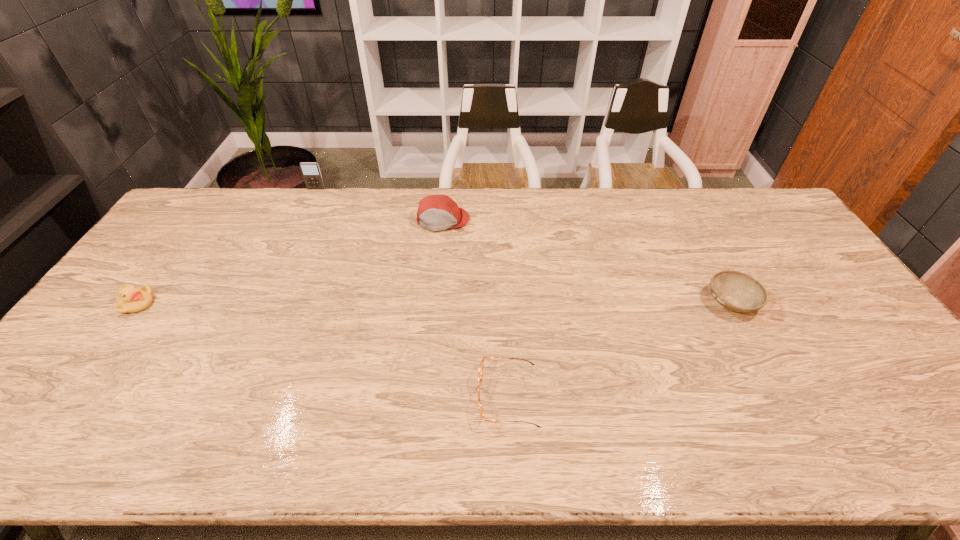
Image resolution: width=960 pixels, height=540 pixels. I want to click on vacant space located 0.140m on the front-facing side of the duckling, so click(202, 304).

You are a GUI agent. You are given a task and a screenshot of the screen. Output one action in this format:
    pyautogui.click(x=<x>, y=<y>)
    Task: Click on the vacant space situated 0.050m on the left of the rightmost object
    This screenshot has width=960, height=540.
    Given the screenshot: What is the action you would take?
    pyautogui.click(x=688, y=302)

Image resolution: width=960 pixels, height=540 pixels. I want to click on vacant space located 0.140m on the front-facing side of the second object from right to left, so click(x=420, y=396).

The width and height of the screenshot is (960, 540). In order to click on vacant point located on the front-facing side of the second object from right to left in this screenshot , I will do `click(407, 396)`.

This screenshot has height=540, width=960. In order to click on blank space located on the front-facing side of the second object from right to left in this screenshot , I will do `click(403, 396)`.

In order to click on iPod at the far edge in this screenshot , I will do `click(311, 173)`.

Identify the location of cap present at the far edge. The width and height of the screenshot is (960, 540). (436, 212).

Locate an element on the screen. object that is at the near edge is located at coordinates (480, 372).

This screenshot has width=960, height=540. What are the coordinates of `object present at the left edge` in the screenshot? It's located at (129, 299).

You are a GUI agent. You are given a task and a screenshot of the screen. Output one action in this format:
    pyautogui.click(x=<x>, y=<y>)
    Task: Click on the free space at the far edge of the desktop
    The height and width of the screenshot is (540, 960).
    Given the screenshot: What is the action you would take?
    pyautogui.click(x=621, y=198)